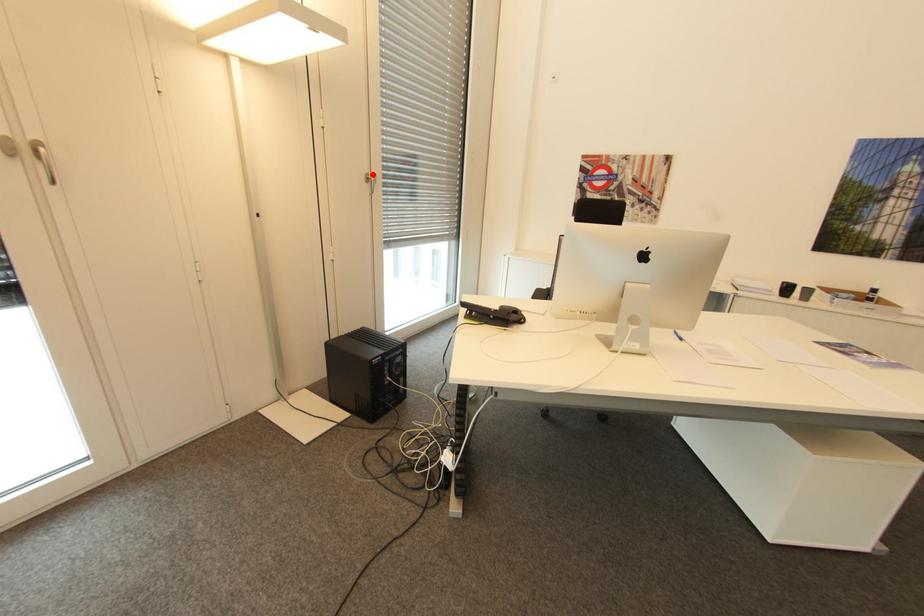
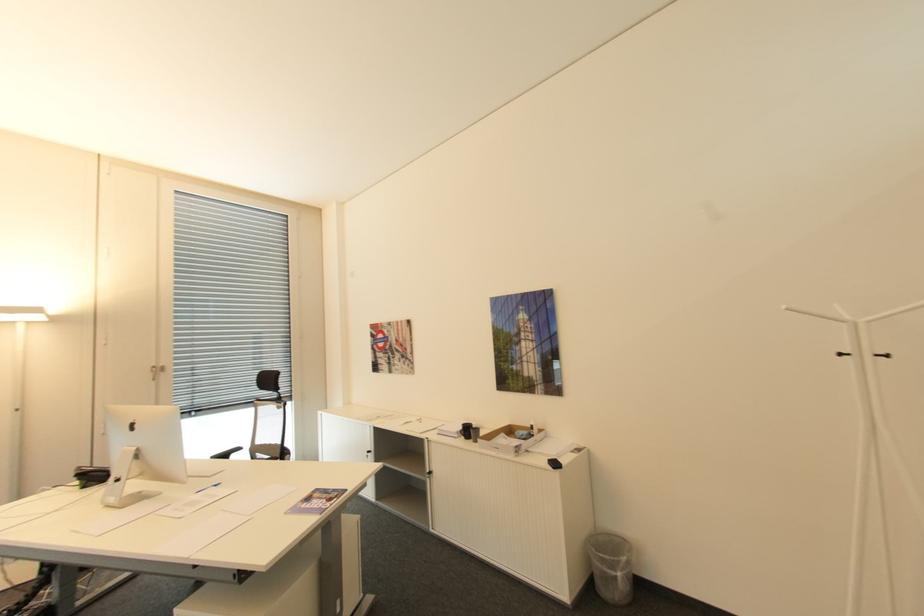
Where in the second image is the point corresponding to the highlighted location from the first image?

(159, 367)